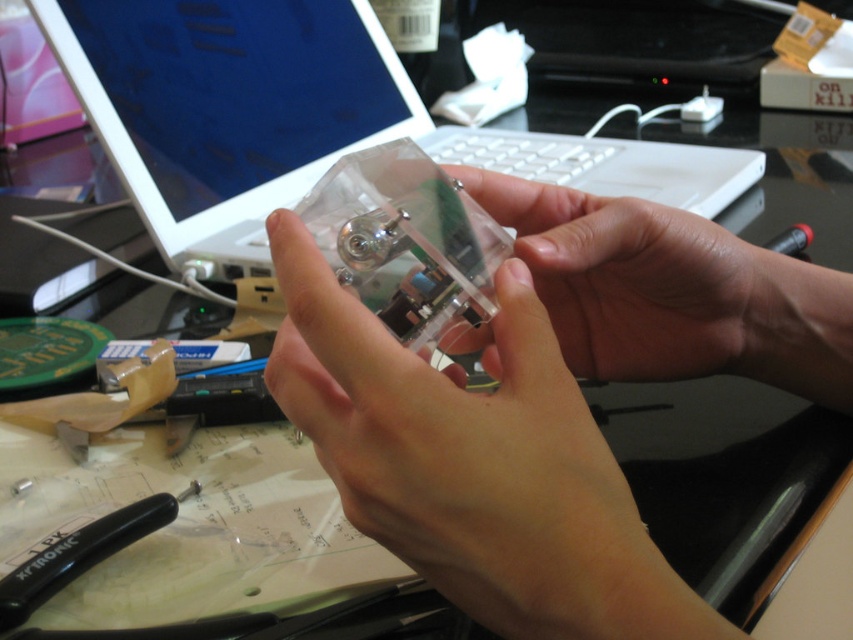
Between transparent plastic object at center and white plastic laptop at upper center, which one appears on the right side from the viewer's perspective?

Positioned to the right is transparent plastic object at center.

The image size is (853, 640). I want to click on transparent plastic object at center, so click(x=544, y=401).